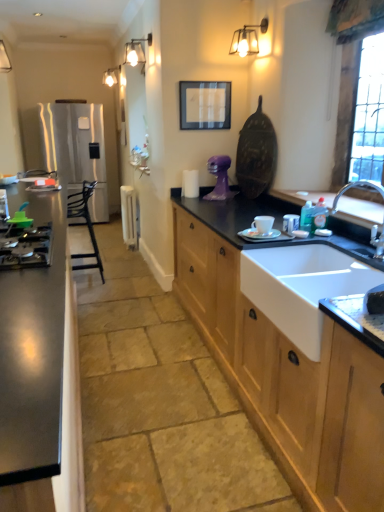
Question: Is white plastic radiator at center, positioned as the 3th appliance in front-to-back order, located within stainless steel cabinet at left, arranged as the 2th cabinetry when viewed from the right?

Choices:
 (A) yes
 (B) no

Answer: (B)

Question: Is the depth of stainless steel cabinet at left, arranged as the 2th cabinetry when viewed from the right, greater than that of white plastic radiator at center, the 1th appliance positioned from the left?

Choices:
 (A) no
 (B) yes

Answer: (A)

Question: From the image's perspective, is stainless steel cabinet at left, arranged as the 2th cabinetry when viewed from the right, over white plastic radiator at center, the 1th appliance positioned from the left?

Choices:
 (A) no
 (B) yes

Answer: (A)

Question: Can you confirm if stainless steel cabinet at left, arranged as the 2th cabinetry when viewed from the right, is taller than white plastic radiator at center, the 1th appliance positioned from the left?

Choices:
 (A) no
 (B) yes

Answer: (B)

Question: Would you consider stainless steel cabinet at left, positioned as the first cabinetry in left-to-right order, to be distant from white plastic radiator at center, the third appliance in the right-to-left sequence?

Choices:
 (A) yes
 (B) no

Answer: (A)

Question: Is stainless steel cabinet at left, positioned as the first cabinetry in left-to-right order, at the right side of white plastic radiator at center, the 1th appliance positioned from the left?

Choices:
 (A) yes
 (B) no

Answer: (B)

Question: Is wooden cabinet at lower right, the 1th cabinetry when ordered from right to left, positioned in front of matte glass sconce at upper center, the 2th light fixture viewed from the right?

Choices:
 (A) yes
 (B) no

Answer: (A)

Question: Would you say wooden cabinet at lower right, the 1th cabinetry when ordered from right to left, is a long distance from matte glass sconce at upper center, the first light fixture viewed from the back?

Choices:
 (A) yes
 (B) no

Answer: (A)

Question: From a real-world perspective, does wooden cabinet at lower right, the 1th cabinetry when ordered from right to left, sit lower than matte glass sconce at upper center, the 1th light fixture in the left-to-right sequence?

Choices:
 (A) no
 (B) yes

Answer: (B)

Question: Is wooden cabinet at lower right, the 2th cabinetry in the left-to-right sequence, smaller than matte glass sconce at upper center, the 2th light fixture viewed from the right?

Choices:
 (A) no
 (B) yes

Answer: (A)

Question: Is wooden cabinet at lower right, the 1th cabinetry when ordered from right to left, to the right of matte glass sconce at upper center, the 2th light fixture viewed from the right, from the viewer's perspective?

Choices:
 (A) yes
 (B) no

Answer: (A)

Question: Does wooden cabinet at lower right, the 2th cabinetry in the left-to-right sequence, have a greater height compared to matte glass sconce at upper center, the first light fixture viewed from the back?

Choices:
 (A) yes
 (B) no

Answer: (A)

Question: Does white ceramic cup at center, which appears as the 3th appliance when viewed from the back, have a larger size compared to chrome metallic faucet at sink right?

Choices:
 (A) no
 (B) yes

Answer: (A)